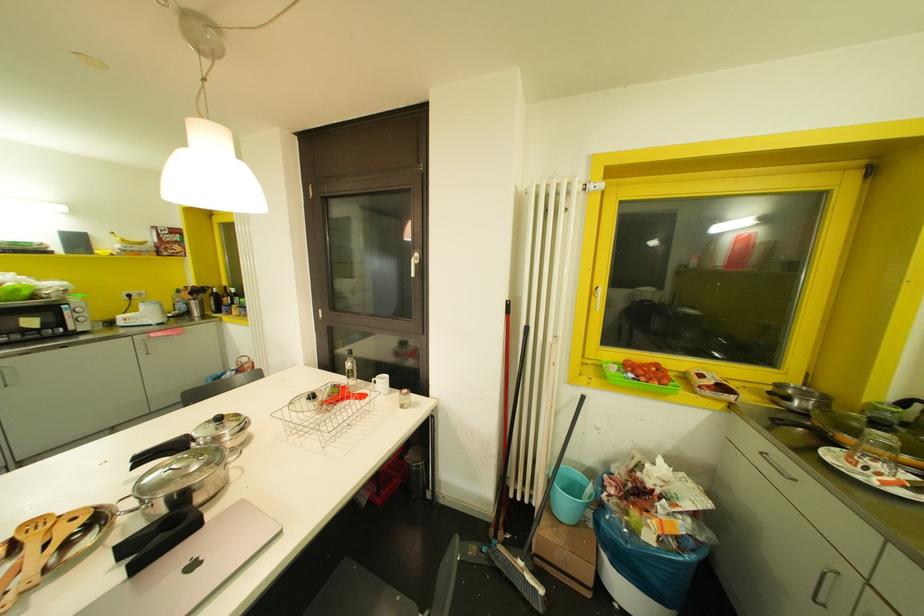
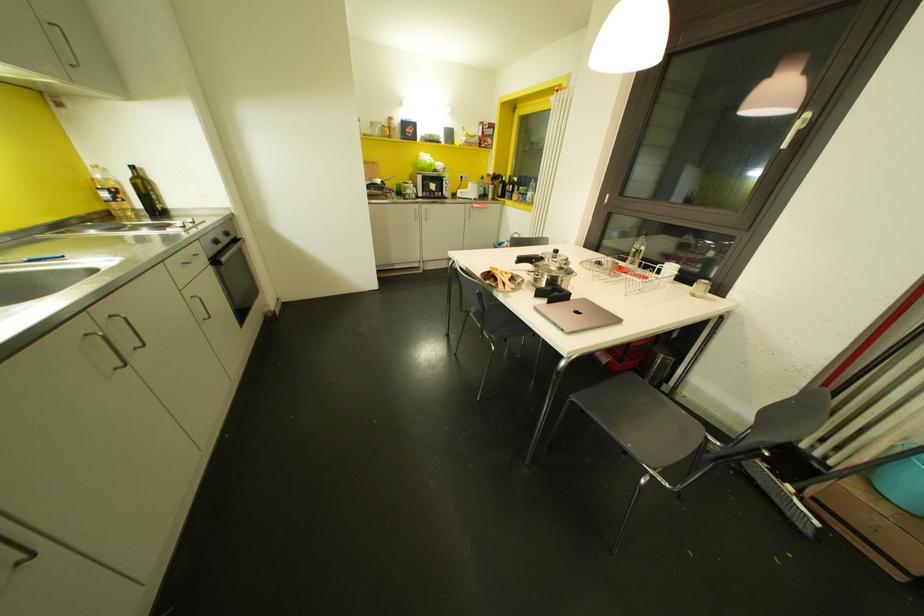
First-person continuous shooting, in which direction is the camera rotating?

The camera rotated toward left-down.